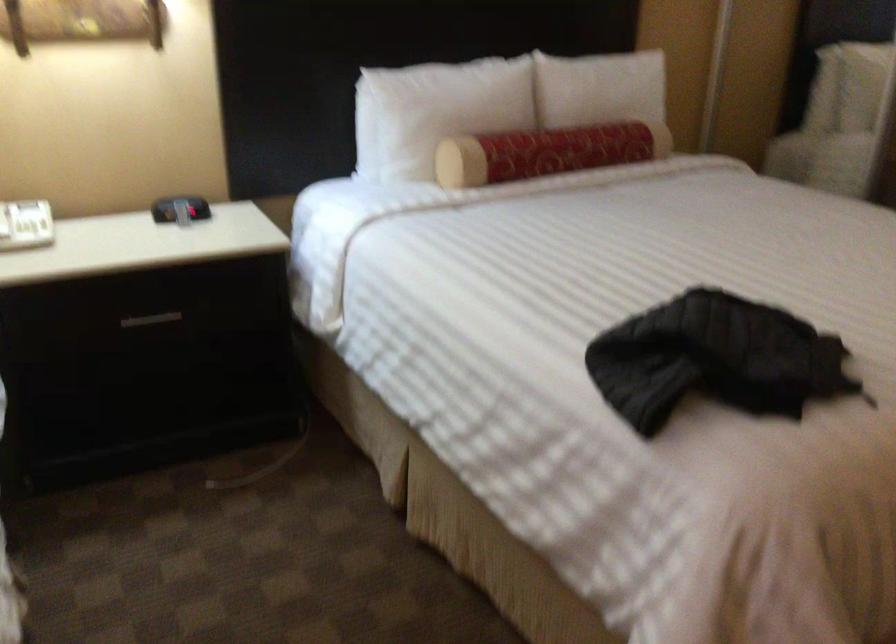
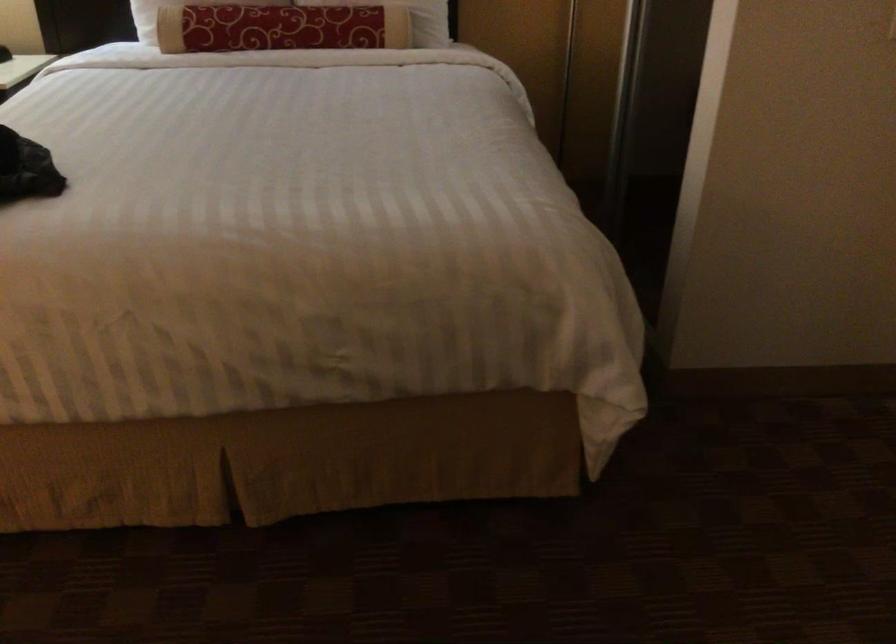
Find the pixel in the second image that matches the point at 574,146 in the first image.

(280, 28)